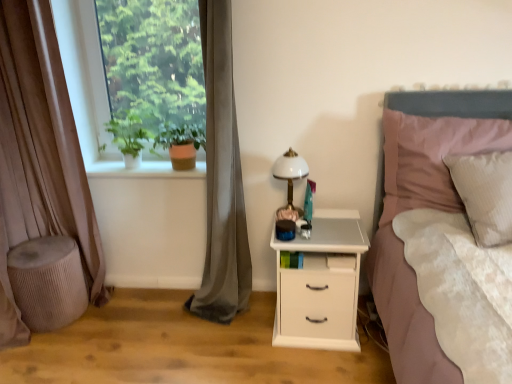
You are a GUI agent. You are given a task and a screenshot of the screen. Output one action in this format:
    pyautogui.click(x=<x>, y=<y>)
    Task: Click on the free space above white matte nightstand at lower right (from a real-world perspective)
    This screenshot has width=512, height=384.
    Given the screenshot: What is the action you would take?
    pyautogui.click(x=319, y=228)